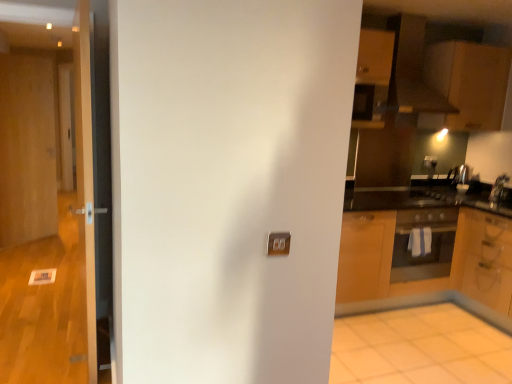
Question: From the image's perspective, is wooden door at left, the 2th door positioned from the left, above or below matte black oven at right?

Choices:
 (A) below
 (B) above

Answer: (B)

Question: In the image, is wooden door at left, marked as the 2th door in a right-to-left arrangement, positioned in front of or behind matte black oven at right?

Choices:
 (A) behind
 (B) front

Answer: (B)

Question: Estimate the real-world distances between objects in this image. Which object is farther from the matte black oven at right?

Choices:
 (A) white glossy door at left, which ranks as the third door in left-to-right order
 (B) wooden door at left, the 2th door positioned from the left
 (C) wooden door at left, acting as the first door starting from the left
 (D) matte brown exhaust hood at upper right
 (E) wooden cabinet at right, which appears as the 2th cabinetry when viewed from the top

Answer: (C)

Question: Estimate the real-world distances between objects in this image. Which object is closer to the matte black oven at right?

Choices:
 (A) matte wood cabinetry at upper right, which appears as the first cabinetry when viewed from the top
 (B) matte brown exhaust hood at upper right
 (C) white glossy door at left, the first door viewed from the front
 (D) wooden cabinet at right, which appears as the 2th cabinetry when viewed from the top
 (E) wooden door at left, the 2th door positioned from the left

Answer: (D)